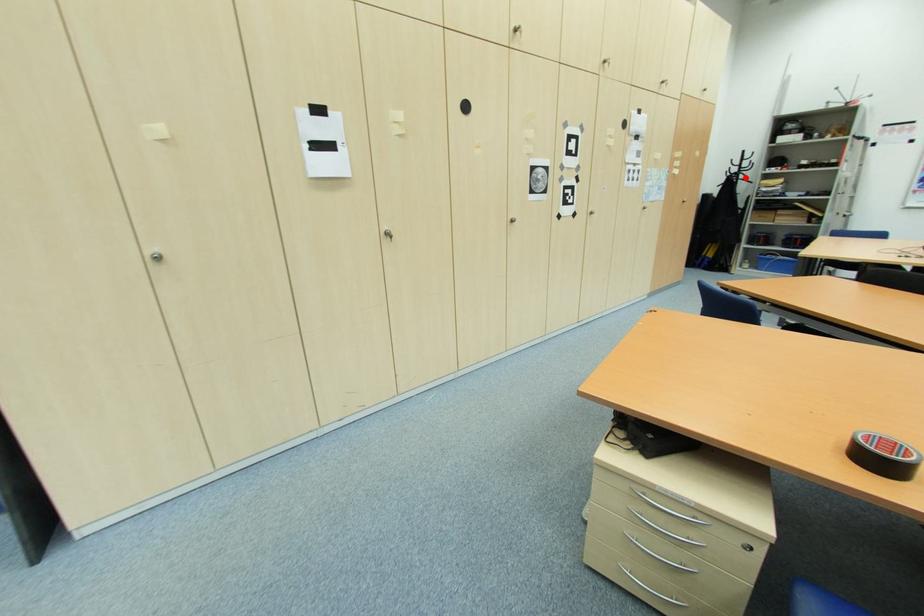
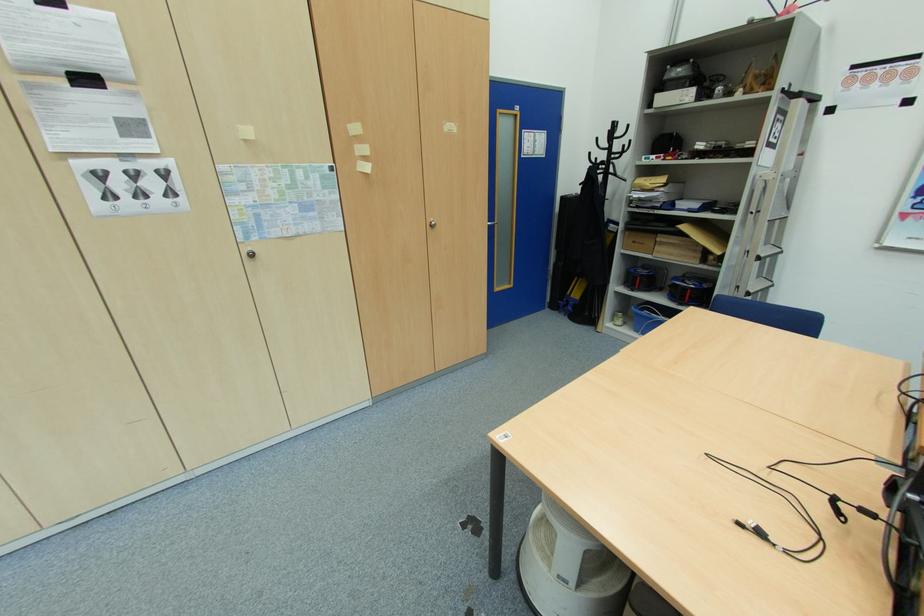
Locate, in the second image, the point that corresponds to the highlighted location in the first image.

(614, 169)